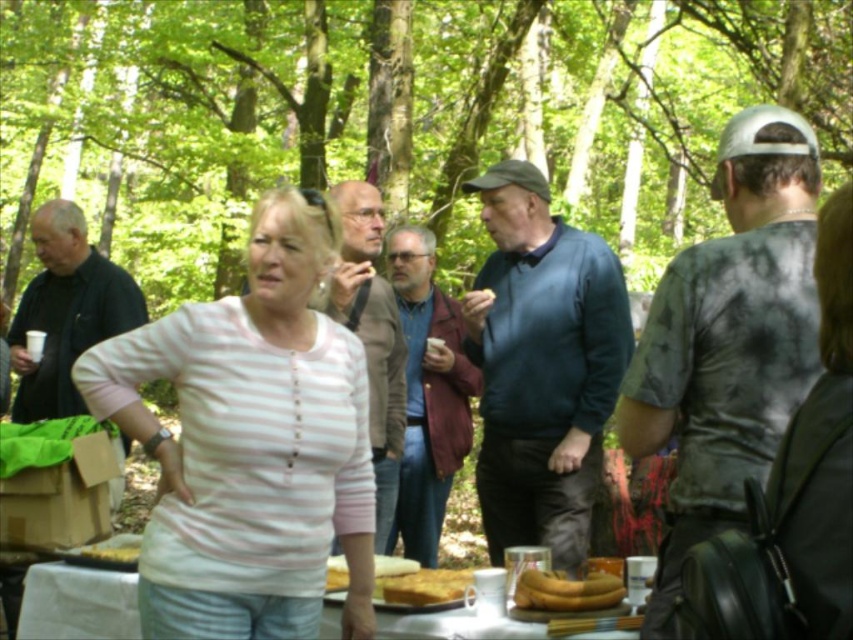
Can you confirm if pink striped shirt at center is shorter than golden brown cake at center?

Incorrect, pink striped shirt at center's height does not fall short of golden brown cake at center's.

Who is positioned more to the right, pink striped shirt at center or golden brown cake at center?

From the viewer's perspective, golden brown cake at center appears more on the right side.

This screenshot has height=640, width=853. Describe the element at coordinates (250, 444) in the screenshot. I see `pink striped shirt at center` at that location.

I want to click on pink striped shirt at center, so click(250, 444).

Looking at this image, is white glossy table at lower center to the left of golden brown cake at center from the viewer's perspective?

Yes, white glossy table at lower center is to the left of golden brown cake at center.

Who is more forward, (332, 614) or (471, 577)?

Point (332, 614)

Locate an element on the screen. This screenshot has height=640, width=853. white glossy table at lower center is located at coordinates (77, 602).

Which is above, white glossy table at lower center or yellow matte bananas at center?

Positioned higher is yellow matte bananas at center.

At what (x,y) coordinates should I click in order to perform the action: click on white glossy table at lower center. Please return your answer as a coordinate pair (x, y). The image size is (853, 640). Looking at the image, I should click on (77, 602).